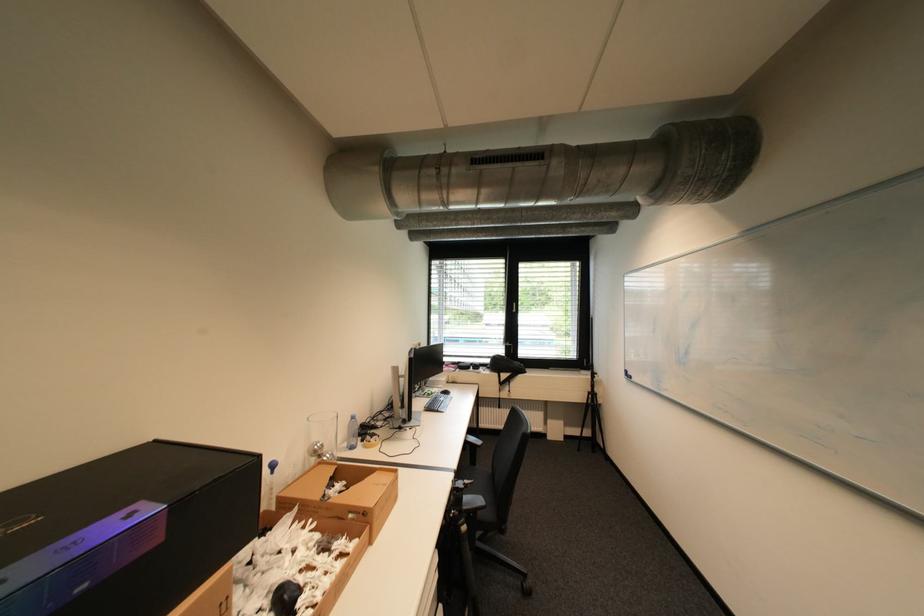
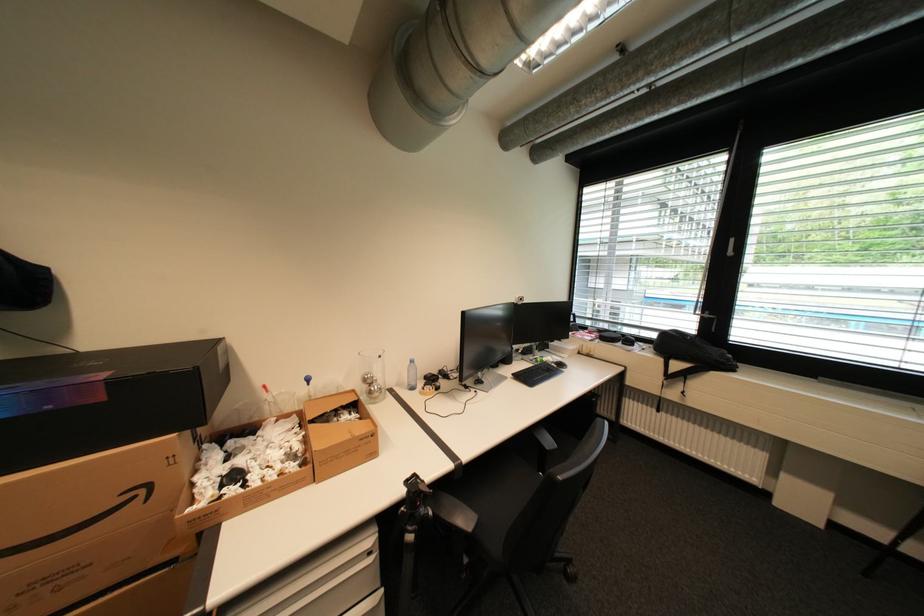
Where in the second image is the point corresponding to the point at 511,384 from the first image?

(678, 377)